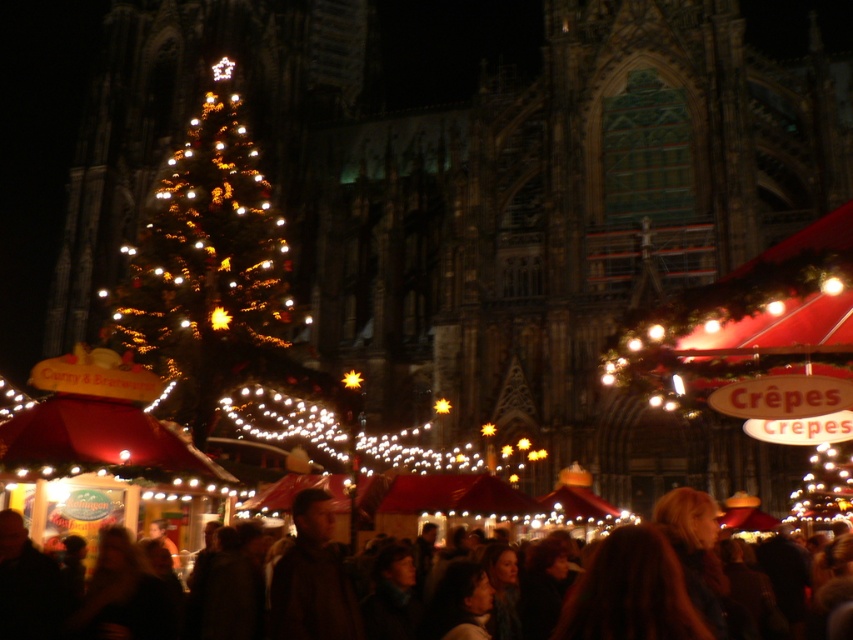
Does illuminated gold christmas tree at center appear on the right side of dark brown hair at lower center?

In fact, illuminated gold christmas tree at center is to the left of dark brown hair at lower center.

Identify the location of illuminated gold christmas tree at center. (209, 269).

This screenshot has height=640, width=853. Identify the location of illuminated gold christmas tree at center. (209, 269).